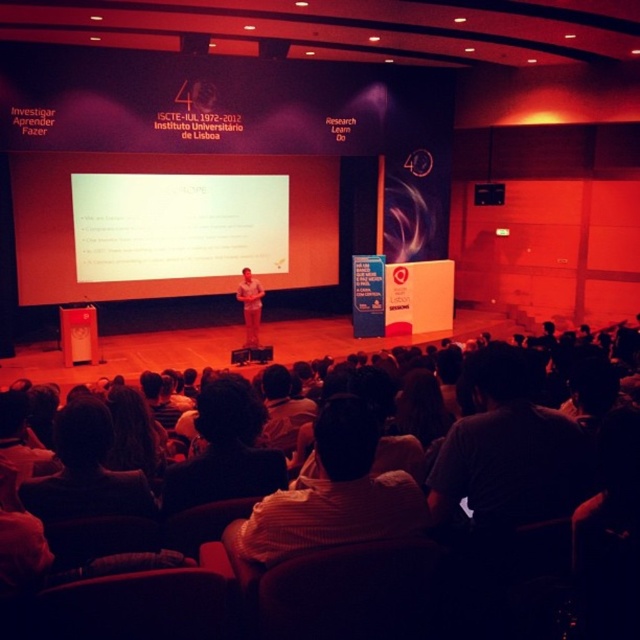
Question: Does white matte projection screen at center have a lesser width compared to dark gray shirt at lower right?

Choices:
 (A) no
 (B) yes

Answer: (B)

Question: Which of the following is the farthest from the observer?

Choices:
 (A) dark gray shirt at lower right
 (B) striped shirt at center

Answer: (A)

Question: Which of the following is the closest to the observer?

Choices:
 (A) dark gray shirt at lower right
 (B) striped shirt at center

Answer: (B)

Question: Estimate the real-world distances between objects in this image. Which object is farther from the white matte projection screen at center?

Choices:
 (A) dark gray shirt at lower right
 (B) striped shirt at center

Answer: (B)

Question: From the image, what is the correct spatial relationship of white matte projection screen at center in relation to dark gray shirt at lower right?

Choices:
 (A) left
 (B) right

Answer: (A)

Question: Is dark gray shirt at lower right closer to the viewer compared to striped shirt at center?

Choices:
 (A) no
 (B) yes

Answer: (A)